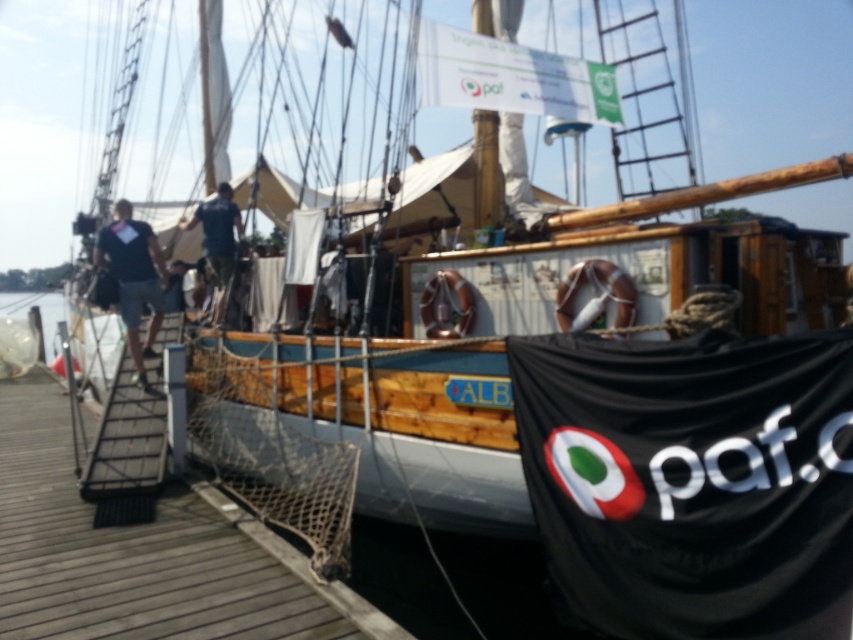
The height and width of the screenshot is (640, 853). Describe the element at coordinates (132, 278) in the screenshot. I see `dark blue shirt at left` at that location.

Is dark blue shirt at left behind clear water at dock left?

No, dark blue shirt at left is in front of clear water at dock left.

Describe the element at coordinates (132, 278) in the screenshot. The width and height of the screenshot is (853, 640). I see `dark blue shirt at left` at that location.

Find the location of a particular element. This screenshot has width=853, height=640. dark blue shirt at left is located at coordinates (132, 278).

Between wooden at left and dark blue shirt at left, which one appears on the left side from the viewer's perspective?

dark blue shirt at left is more to the left.

Based on the photo, is wooden at left taller than dark blue shirt at left?

No.

Is point (4, 452) farther from viewer compared to point (138, 237)?

No, it is not.

Identify the location of wooden at left. (144, 554).

Consider the image. Who is more forward, (386,636) or (21,292)?

Positioned in front is point (386,636).

Measure the distance between wooden at left and camera.

wooden at left and camera are 3.97 meters apart from each other.

Who is more distant from viewer, [268,577] or [50,337]?

Positioned behind is point [50,337].

Image resolution: width=853 pixels, height=640 pixels. I want to click on wooden at left, so click(144, 554).